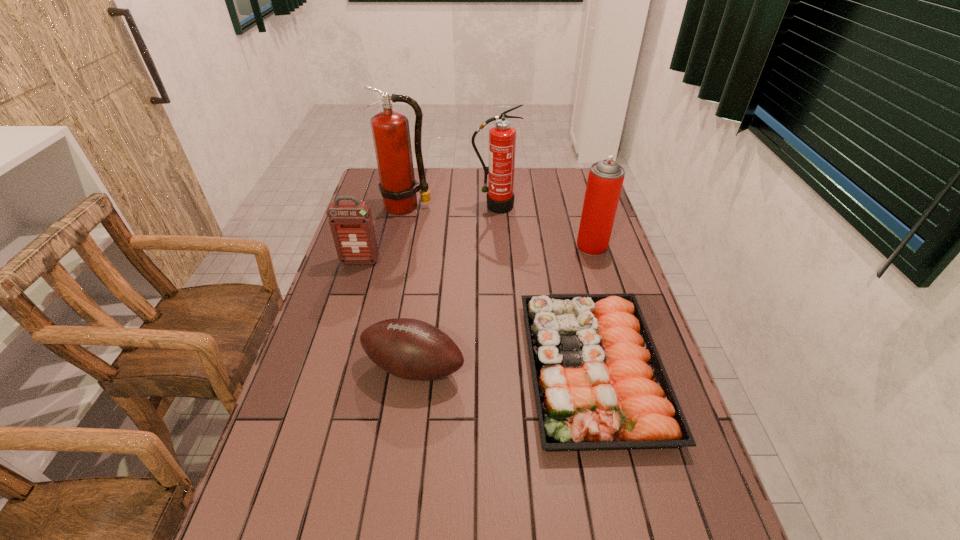
Locate an element on the screen. This screenshot has height=540, width=960. object that is at the far left corner is located at coordinates (390, 129).

The height and width of the screenshot is (540, 960). Identify the location of vacant space at the far edge. (537, 190).

You are a GUI agent. You are given a task and a screenshot of the screen. Output one action in this format:
    pyautogui.click(x=<x>, y=<y>)
    Task: Click on the vacant region at the left edge of the desktop
    Image resolution: width=960 pixels, height=540 pixels.
    Given the screenshot: What is the action you would take?
    pyautogui.click(x=352, y=356)

Image resolution: width=960 pixels, height=540 pixels. In the image, there is a desktop. In order to click on vacant region at the right edge in this screenshot , I will do `click(589, 259)`.

In the image, there is a desktop. Identify the location of vacant space at the far right corner. This screenshot has height=540, width=960. (584, 182).

You are a GUI agent. You are given a task and a screenshot of the screen. Output one action in this format:
    pyautogui.click(x=<x>, y=<y>)
    Task: Click on the free area in between the football (American) and the right fire extinguisher
    
    Given the screenshot: What is the action you would take?
    [x=454, y=287]

I want to click on empty space that is in between the shorter fire extinguisher and the shortest object, so click(x=544, y=288).

Where is `vacant area between the left fire extinguisher and the third shortest object`? vacant area between the left fire extinguisher and the third shortest object is located at coordinates (383, 234).

Find the location of a particular element. The height and width of the screenshot is (540, 960). vacant space in between the first-aid kit and the third tallest object is located at coordinates (476, 254).

Locate an element on the screen. The image size is (960, 540). empty space that is in between the left fire extinguisher and the right fire extinguisher is located at coordinates (451, 206).